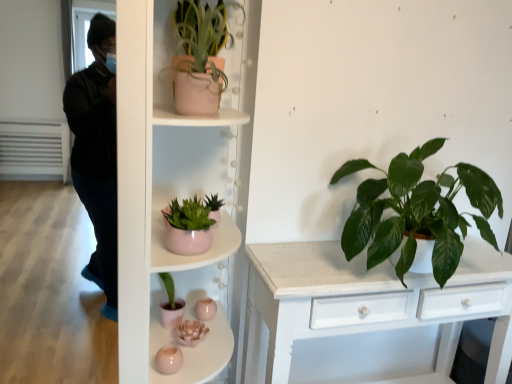
Question: From the image's perspective, is matte pink pot at center, which ranks as the first shelf in top-to-bottom order, located beneath green glossy leafy plant at right, which is the 1th houseplant from bottom to top?

Choices:
 (A) yes
 (B) no

Answer: (A)

Question: From the image's perspective, is matte pink pot at center, the 2th shelf ordered from the bottom, on green glossy leafy plant at right, placed as the 2th houseplant when sorted from top to bottom?

Choices:
 (A) yes
 (B) no

Answer: (B)

Question: Considering the relative sizes of matte pink pot at center, which ranks as the first shelf in top-to-bottom order, and green glossy leafy plant at right, the 1th houseplant in the right-to-left sequence, in the image provided, is matte pink pot at center, which ranks as the first shelf in top-to-bottom order, smaller than green glossy leafy plant at right, the 1th houseplant in the right-to-left sequence,?

Choices:
 (A) no
 (B) yes

Answer: (B)

Question: Considering the relative positions of matte pink pot at center, which ranks as the first shelf in top-to-bottom order, and green glossy leafy plant at right, the 1th houseplant in the right-to-left sequence, in the image provided, is matte pink pot at center, which ranks as the first shelf in top-to-bottom order, to the right of green glossy leafy plant at right, the 1th houseplant in the right-to-left sequence, from the viewer's perspective?

Choices:
 (A) no
 (B) yes

Answer: (A)

Question: From a real-world perspective, is matte pink pot at center, which ranks as the first shelf in top-to-bottom order, beneath green glossy leafy plant at right, which is counted as the 2th houseplant, starting from the left?

Choices:
 (A) no
 (B) yes

Answer: (B)

Question: From the image's perspective, is matte pink pot at center, the 2th shelf ordered from the bottom, positioned above or below matte pink pot at upper center, marked as the second houseplant in a right-to-left arrangement?

Choices:
 (A) above
 (B) below

Answer: (B)

Question: Looking at their shapes, would you say matte pink pot at center, the 2th shelf ordered from the bottom, is wider or thinner than matte pink pot at upper center, which appears as the 1th houseplant when viewed from the left?

Choices:
 (A) wide
 (B) thin

Answer: (B)

Question: In terms of height, does matte pink pot at center, which ranks as the first shelf in top-to-bottom order, look taller or shorter compared to matte pink pot at upper center, which is the 2th houseplant from bottom to top?

Choices:
 (A) short
 (B) tall

Answer: (A)

Question: Considering the positions of point (184, 268) and point (224, 13), is point (184, 268) closer or farther from the camera than point (224, 13)?

Choices:
 (A) farther
 (B) closer

Answer: (A)

Question: Is matte pink pot at center, the 2th shelf positioned from the top, in front of or behind matte pink pot at center, the 2th shelf ordered from the bottom, in the image?

Choices:
 (A) behind
 (B) front

Answer: (B)

Question: Which is correct: matte pink pot at center, the 2th shelf positioned from the top, is inside matte pink pot at center, the 2th shelf ordered from the bottom, or outside of it?

Choices:
 (A) outside
 (B) inside

Answer: (A)

Question: From the image's perspective, is matte pink pot at center, the 2th shelf positioned from the top, located above or below matte pink pot at center, which ranks as the first shelf in top-to-bottom order?

Choices:
 (A) above
 (B) below

Answer: (B)

Question: Is matte pink pot at center, which ranks as the 1th shelf in bottom-to-top order, taller or shorter than matte pink pot at center, which ranks as the first shelf in top-to-bottom order?

Choices:
 (A) short
 (B) tall

Answer: (B)

Question: In terms of width, does matte pink pot at center, the 2th shelf positioned from the top, look wider or thinner when compared to matte pink pot at upper center, which appears as the 1th houseplant when viewed from the left?

Choices:
 (A) wide
 (B) thin

Answer: (A)

Question: From the image's perspective, is matte pink pot at center, which ranks as the 1th shelf in bottom-to-top order, positioned above or below matte pink pot at upper center, marked as the second houseplant in a right-to-left arrangement?

Choices:
 (A) above
 (B) below

Answer: (B)